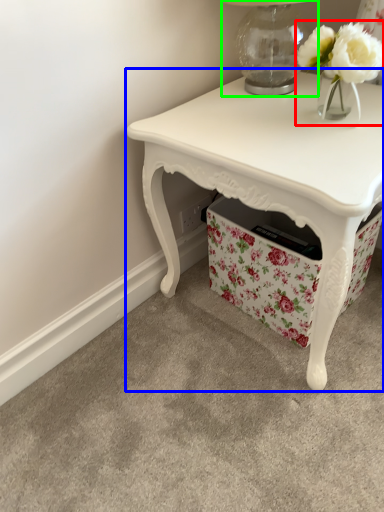
Question: Estimate the real-world distances between objects in this image. Which object is farther from floral arrangement (highlighted by a red box), table (highlighted by a blue box) or table lamp (highlighted by a green box)?

Choices:
 (A) table
 (B) table lamp

Answer: (A)